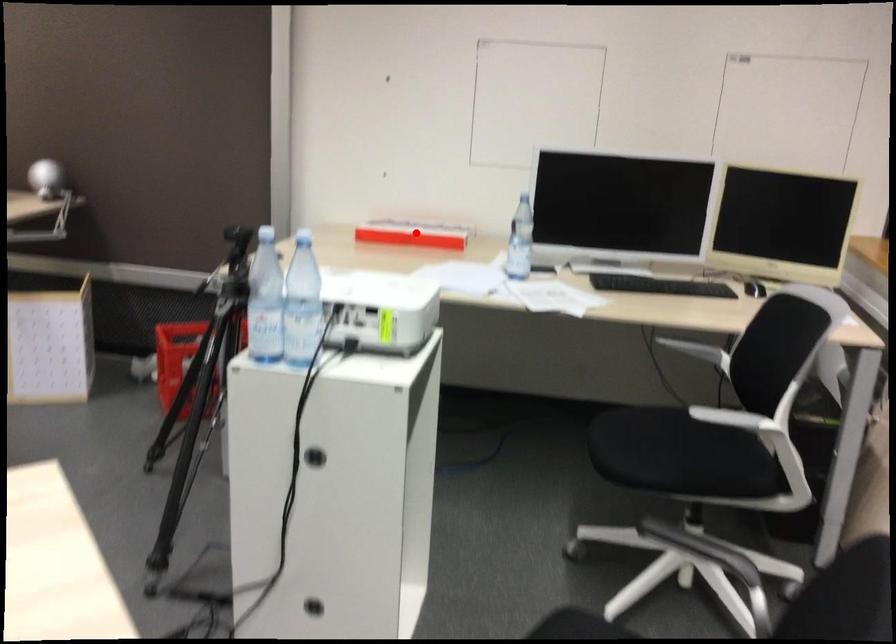
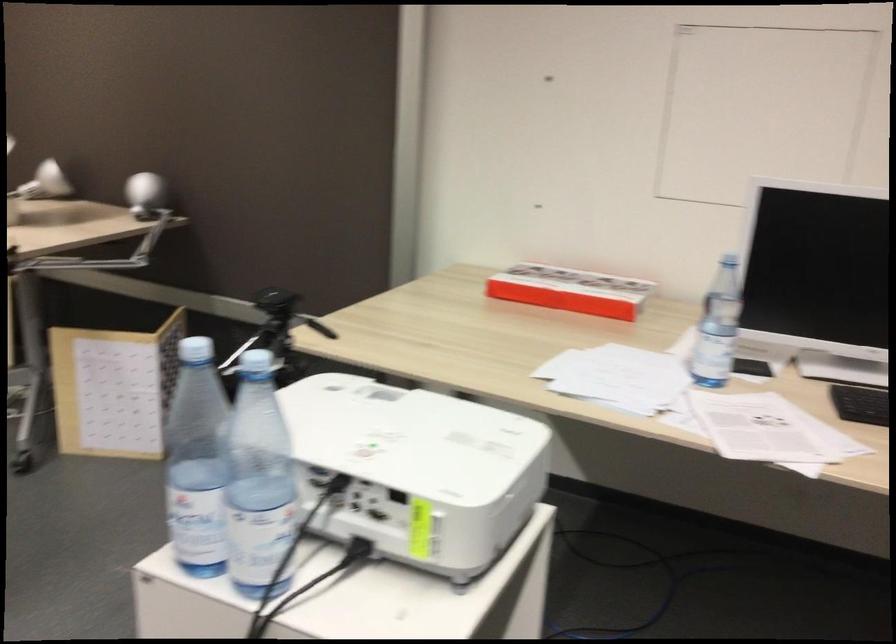
Where in the second image is the point corresponding to the highlighted location from the first image?

(570, 290)